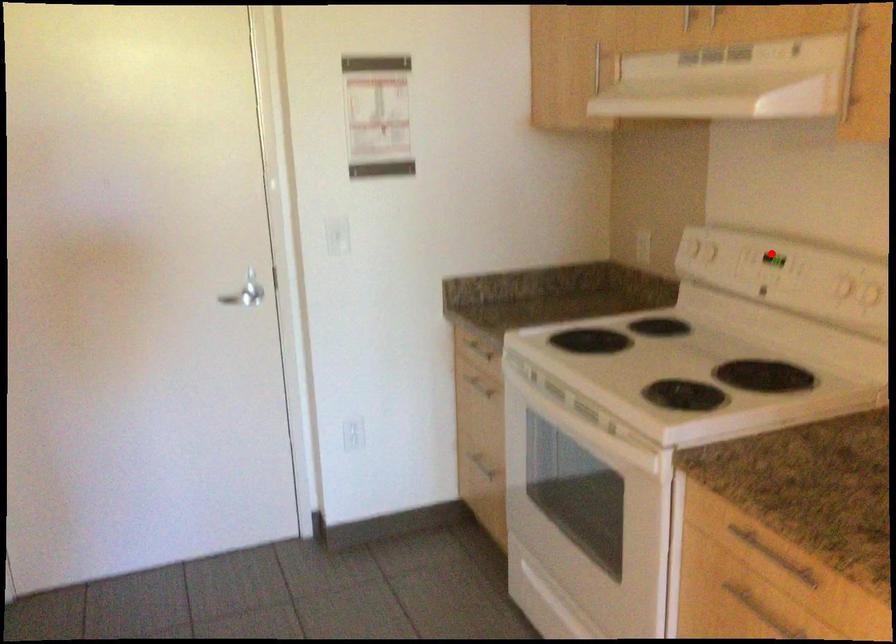
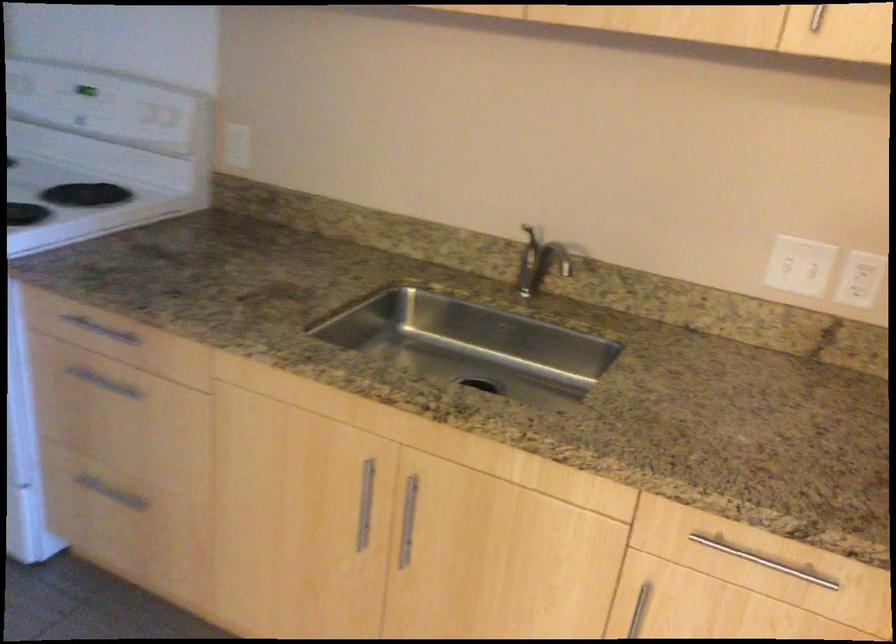
Find the pixel in the second image that matches the highlighted location in the first image.

(85, 90)